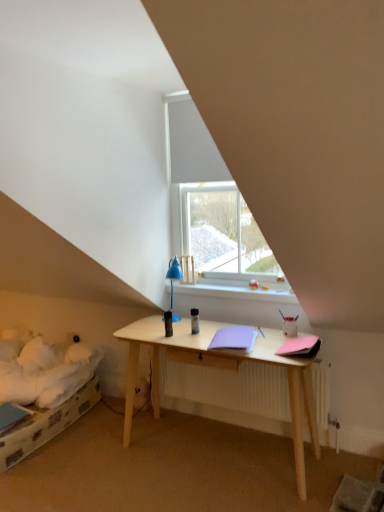
Question: Considering the relative positions of white plastic window sill at center and lavender matte notebook at center, positioned as the 2th notebook in right-to-left order, in the image provided, is white plastic window sill at center to the left of lavender matte notebook at center, positioned as the 2th notebook in right-to-left order, from the viewer's perspective?

Choices:
 (A) no
 (B) yes

Answer: (A)

Question: Is white plastic window sill at center outside of lavender matte notebook at center, positioned as the 2th notebook in right-to-left order?

Choices:
 (A) yes
 (B) no

Answer: (A)

Question: From a real-world perspective, does white plastic window sill at center stand above lavender matte notebook at center, positioned as the first notebook in left-to-right order?

Choices:
 (A) no
 (B) yes

Answer: (B)

Question: Would you consider white plastic window sill at center to be distant from lavender matte notebook at center, positioned as the 2th notebook in right-to-left order?

Choices:
 (A) yes
 (B) no

Answer: (B)

Question: Is the position of white plastic window sill at center less distant than that of lavender matte notebook at center, positioned as the 2th notebook in right-to-left order?

Choices:
 (A) yes
 (B) no

Answer: (B)

Question: Is white plastic window sill at center further to the viewer compared to lavender matte notebook at center, positioned as the first notebook in left-to-right order?

Choices:
 (A) yes
 (B) no

Answer: (A)

Question: Is pink matte notebook at right, positioned as the first notebook in right-to-left order, located outside lavender matte notebook at center, positioned as the 2th notebook in right-to-left order?

Choices:
 (A) no
 (B) yes

Answer: (B)

Question: From a real-world perspective, is pink matte notebook at right, which ranks as the second notebook in left-to-right order, physically below lavender matte notebook at center, positioned as the 2th notebook in right-to-left order?

Choices:
 (A) no
 (B) yes

Answer: (A)

Question: From the image's perspective, is pink matte notebook at right, which ranks as the second notebook in left-to-right order, located above lavender matte notebook at center, positioned as the 2th notebook in right-to-left order?

Choices:
 (A) yes
 (B) no

Answer: (B)

Question: Can you confirm if pink matte notebook at right, which ranks as the second notebook in left-to-right order, is wider than lavender matte notebook at center, positioned as the 2th notebook in right-to-left order?

Choices:
 (A) yes
 (B) no

Answer: (B)

Question: Is pink matte notebook at right, which ranks as the second notebook in left-to-right order, at the right side of lavender matte notebook at center, positioned as the first notebook in left-to-right order?

Choices:
 (A) no
 (B) yes

Answer: (B)

Question: From the image's perspective, is pink matte notebook at right, which ranks as the second notebook in left-to-right order, under lavender matte notebook at center, positioned as the 2th notebook in right-to-left order?

Choices:
 (A) no
 (B) yes

Answer: (B)

Question: Are white plastic window sill at center and pink matte notebook at right, positioned as the first notebook in right-to-left order, located far from each other?

Choices:
 (A) no
 (B) yes

Answer: (A)